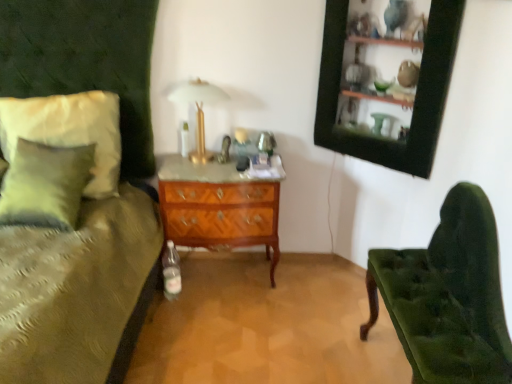
Question: From the image's perspective, would you say gold metallic table lamp at upper center is positioned over velvet green chair at right?

Choices:
 (A) yes
 (B) no

Answer: (A)

Question: From a real-world perspective, is gold metallic table lamp at upper center beneath velvet green chair at right?

Choices:
 (A) yes
 (B) no

Answer: (B)

Question: Could you tell me if gold metallic table lamp at upper center is turned towards velvet green chair at right?

Choices:
 (A) yes
 (B) no

Answer: (B)

Question: Is gold metallic table lamp at upper center positioned behind velvet green chair at right?

Choices:
 (A) no
 (B) yes

Answer: (B)

Question: Does gold metallic table lamp at upper center have a lesser width compared to velvet green chair at right?

Choices:
 (A) yes
 (B) no

Answer: (A)

Question: Is the position of gold metallic table lamp at upper center less distant than that of velvet green chair at right?

Choices:
 (A) yes
 (B) no

Answer: (B)

Question: Is woodenwoodenchest of drawers at center oriented towards gold metallic table lamp at upper center?

Choices:
 (A) yes
 (B) no

Answer: (B)

Question: From a real-world perspective, is woodenwoodenchest of drawers at center physically below gold metallic table lamp at upper center?

Choices:
 (A) yes
 (B) no

Answer: (A)

Question: Can you confirm if woodenwoodenchest of drawers at center is thinner than gold metallic table lamp at upper center?

Choices:
 (A) no
 (B) yes

Answer: (A)

Question: Can you confirm if woodenwoodenchest of drawers at center is wider than gold metallic table lamp at upper center?

Choices:
 (A) no
 (B) yes

Answer: (B)

Question: Does woodenwoodenchest of drawers at center have a larger size compared to gold metallic table lamp at upper center?

Choices:
 (A) no
 (B) yes

Answer: (B)

Question: Does woodenwoodenchest of drawers at center have a smaller size compared to gold metallic table lamp at upper center?

Choices:
 (A) yes
 (B) no

Answer: (B)

Question: Is the depth of gold metallic table lamp at upper center greater than that of soft white fabric pillow at left?

Choices:
 (A) yes
 (B) no

Answer: (A)